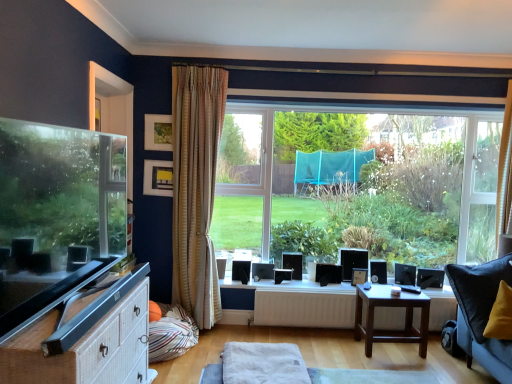
Where is `vacant area situated below white matte radiator at center (from a real-world perspective)`? The width and height of the screenshot is (512, 384). vacant area situated below white matte radiator at center (from a real-world perspective) is located at coordinates (303, 328).